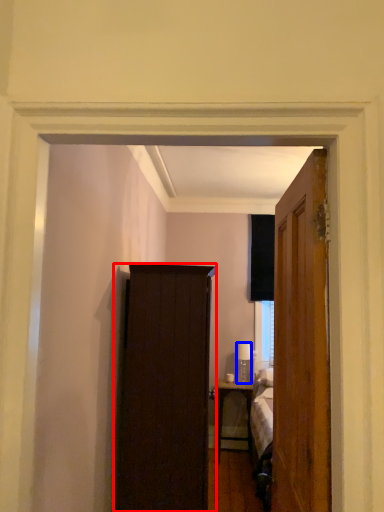
Question: Among these objects, which one is farthest to the camera, cabinetry (highlighted by a red box) or lamp (highlighted by a blue box)?

Choices:
 (A) cabinetry
 (B) lamp

Answer: (B)